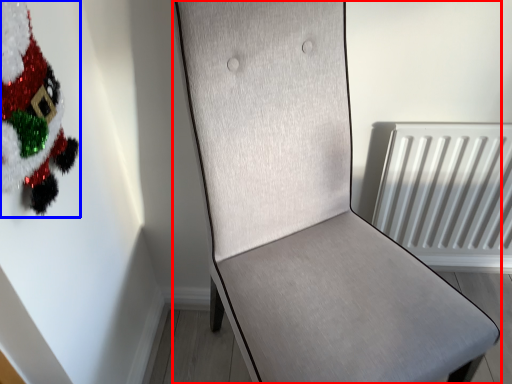
Question: Which of the following is the closest to the observer, furniture (highlighted by a red box) or christmas tree (highlighted by a blue box)?

Choices:
 (A) furniture
 (B) christmas tree

Answer: (A)